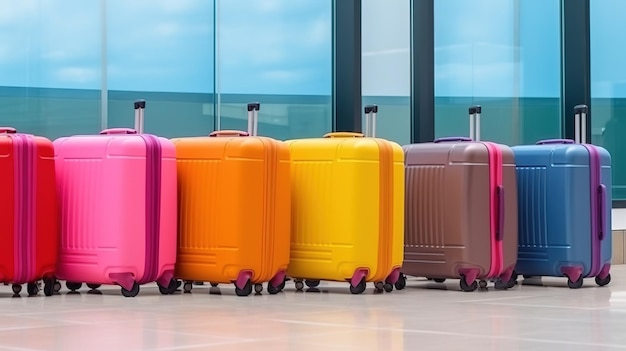
Where is `window`? Image resolution: width=626 pixels, height=351 pixels. window is located at coordinates (64, 39), (175, 37), (280, 42), (387, 49), (481, 50), (608, 45).